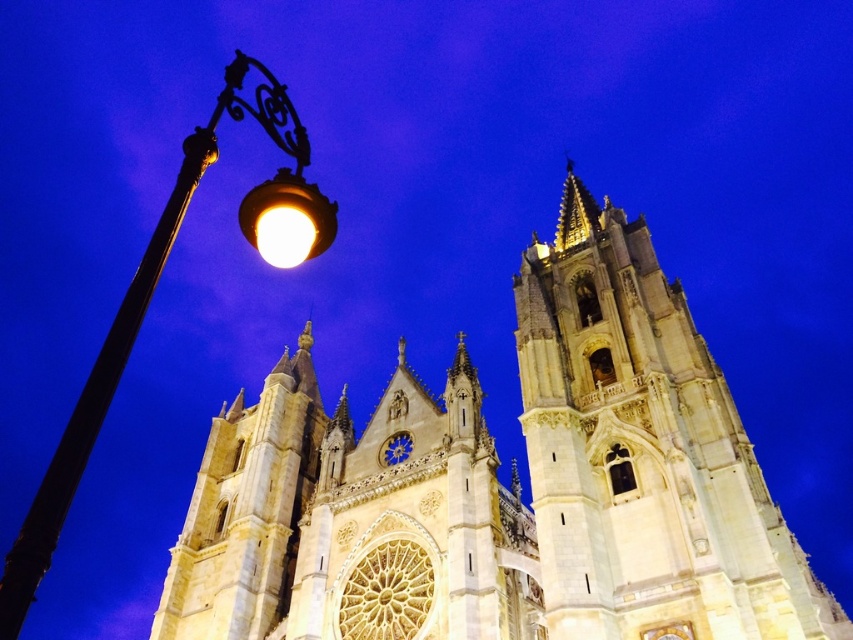
Question: Is the position of white stone tower at upper right more distant than that of matte glass streetlight at upper left?

Choices:
 (A) yes
 (B) no

Answer: (A)

Question: Can you confirm if light beige stone church at left is thinner than white stone tower at upper right?

Choices:
 (A) no
 (B) yes

Answer: (A)

Question: Which point appears farthest from the camera in this image?

Choices:
 (A) (302, 227)
 (B) (281, 266)
 (C) (328, 220)
 (D) (434, 556)

Answer: (D)

Question: Where is light beige stone church at left located in relation to matte glass streetlight at left in the image?

Choices:
 (A) left
 (B) right

Answer: (B)

Question: Which object is the farthest from the matte glass streetlight at upper left?

Choices:
 (A) light beige stone church at left
 (B) matte black lamp post at left
 (C) matte glass streetlight at left

Answer: (B)

Question: Which point is farther to the camera?

Choices:
 (A) (706, 492)
 (B) (564, 486)
 (C) (294, 257)
 (D) (10, 634)

Answer: (B)